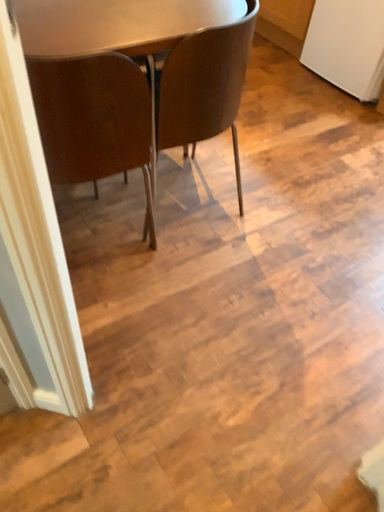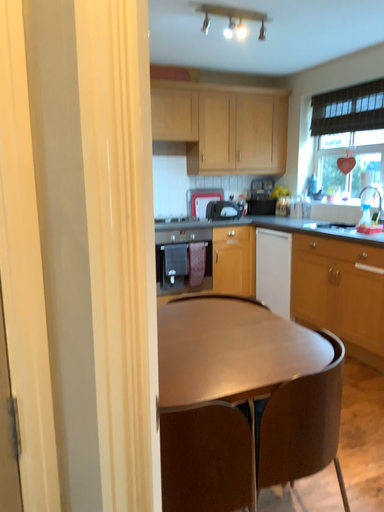
Question: Which way did the camera rotate in the video?

Choices:
 (A) rotated upward
 (B) rotated downward

Answer: (A)